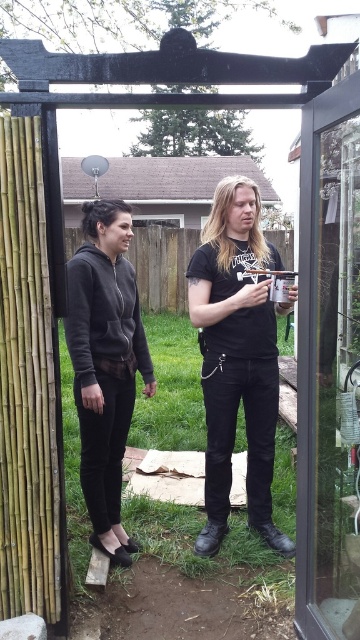
Locate an element on the screen. The image size is (360, 640). transparent glass screen door at right is located at coordinates (329, 365).

Is transparent glass screen door at right taller than dark gray hoodie at center?

Indeed, transparent glass screen door at right has a greater height compared to dark gray hoodie at center.

Is point (345, 452) less distant than point (117, 410)?

Yes, it is.

Where is `transparent glass screen door at right`? The width and height of the screenshot is (360, 640). transparent glass screen door at right is located at coordinates (329, 365).

Is point (209, 506) behind point (91, 204)?

Yes.

Is matte black hoodie at center shorter than dark gray hoodie at center?

Incorrect, matte black hoodie at center's height does not fall short of dark gray hoodie at center's.

Who is more forward, (x=226, y=412) or (x=104, y=534)?

Point (x=226, y=412) is in front.

Identify the location of matte black hoodie at center. (236, 358).

Which is more to the left, transparent glass screen door at right or matte black hoodie at center?

matte black hoodie at center

Locate an element on the screen. The width and height of the screenshot is (360, 640). transparent glass screen door at right is located at coordinates (329, 365).

Identify the location of transparent glass screen door at right. This screenshot has height=640, width=360. (329, 365).